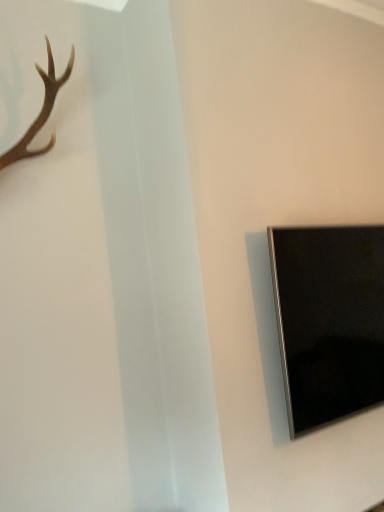
What do you see at coordinates (329, 321) in the screenshot? I see `silver metallic picture frame at lower right` at bounding box center [329, 321].

Where is `silver metallic picture frame at lower right`? The width and height of the screenshot is (384, 512). silver metallic picture frame at lower right is located at coordinates (329, 321).

What is the approximate height of silver metallic picture frame at lower right?

silver metallic picture frame at lower right is 28.83 inches tall.

This screenshot has height=512, width=384. I want to click on silver metallic picture frame at lower right, so click(x=329, y=321).